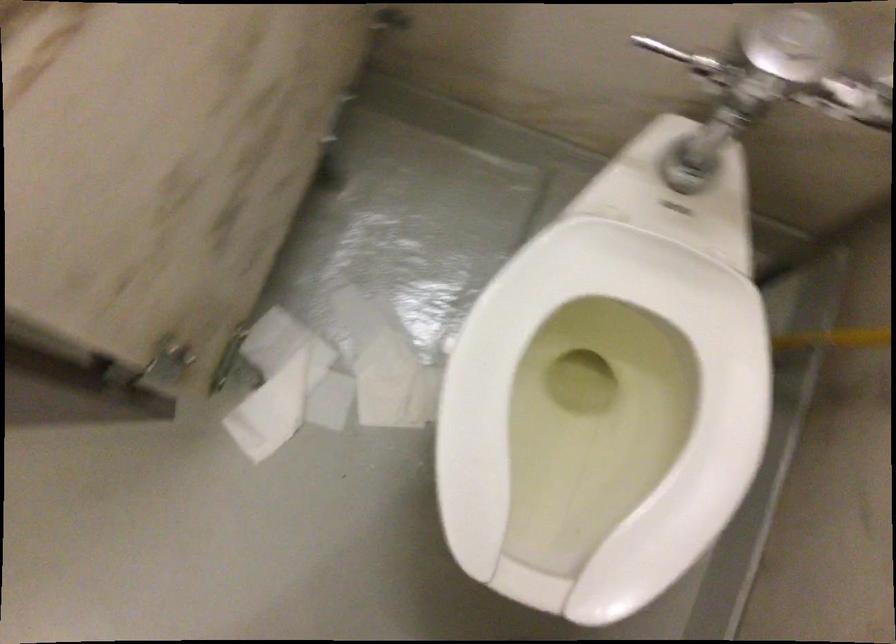
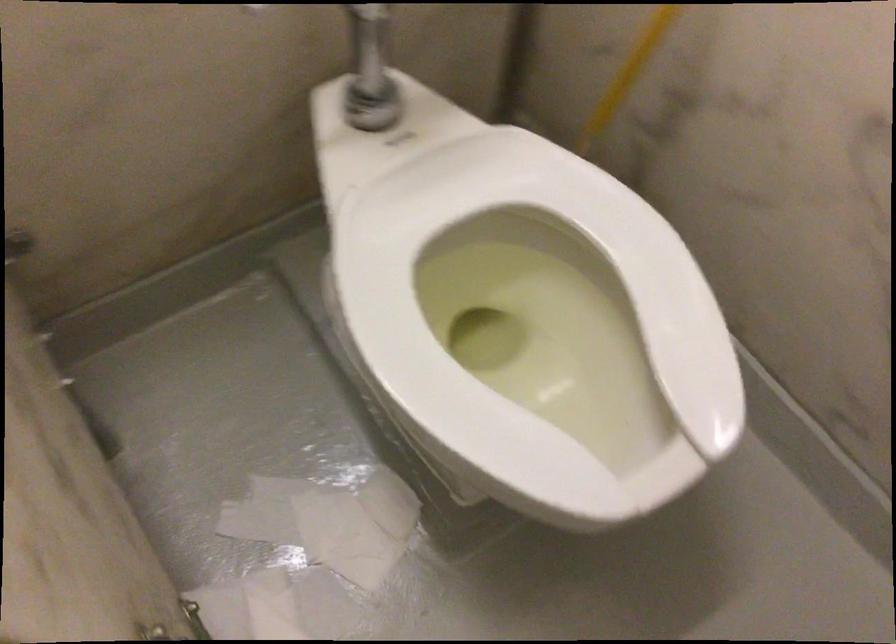
Locate, in the second image, the point that corresponds to (375,357) in the first image.

(320, 529)